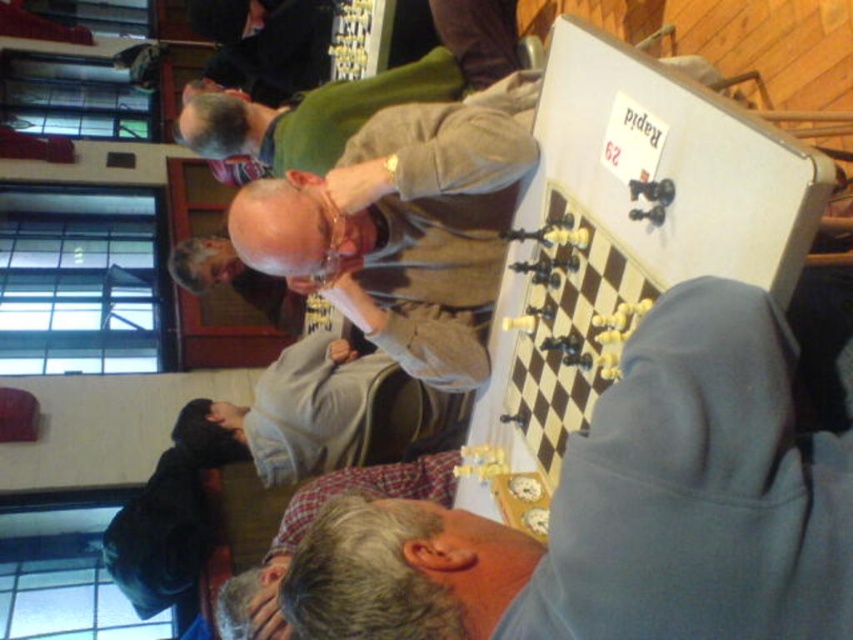
Question: Among these objects, which one is nearest to the camera?

Choices:
 (A) gray hoodie at center
 (B) gray sweatshirt at lower left
 (C) gray plaid shirt at lower center
 (D) light brown fabric shirt at center

Answer: (A)

Question: Considering the relative positions of gray sweatshirt at lower left and gray plaid shirt at lower center in the image provided, where is gray sweatshirt at lower left located with respect to gray plaid shirt at lower center?

Choices:
 (A) right
 (B) left

Answer: (B)

Question: Which object appears farthest from the camera in this image?

Choices:
 (A) gray sweatshirt at lower left
 (B) gray hoodie at center
 (C) gray plaid shirt at lower center
 (D) light brown fabric shirt at center

Answer: (A)

Question: From the image, what is the correct spatial relationship of light brown fabric shirt at center in relation to gray plaid shirt at lower center?

Choices:
 (A) below
 (B) above

Answer: (B)

Question: Among these points, which one is nearest to the camera?

Choices:
 (A) (270, 550)
 (B) (424, 394)

Answer: (A)

Question: Does gray sweatshirt at lower left have a larger size compared to gray plaid shirt at lower center?

Choices:
 (A) yes
 (B) no

Answer: (A)